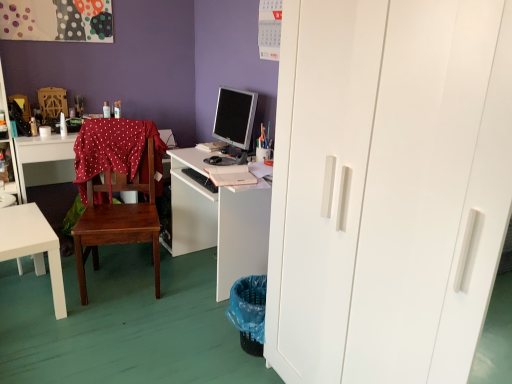
Question: Visually, is black matte keyboard at center positioned to the left or to the right of white glossy coffee cup at upper left?

Choices:
 (A) right
 (B) left

Answer: (A)

Question: Is point (196, 180) positioned closer to the camera than point (40, 125)?

Choices:
 (A) closer
 (B) farther

Answer: (A)

Question: Based on their relative distances, which object is nearer to the red polka dot fabric at center?

Choices:
 (A) wooden chair at center
 (B) silver metallic monitor at center
 (C) white glossy coffee cup at upper left
 (D) black matte keyboard at center
 (E) wooden desk at left, acting as the 2th desk starting from the left

Answer: (A)

Question: Considering the real-world distances, which object is closest to the red polka dot fabric at center?

Choices:
 (A) wooden chair at center
 (B) white glossy coffee cup at upper left
 (C) white glossy table at lower left, marked as the third desk in a right-to-left arrangement
 (D) white matte desk at center, the first desk when ordered from right to left
 (E) silver metallic monitor at center

Answer: (A)